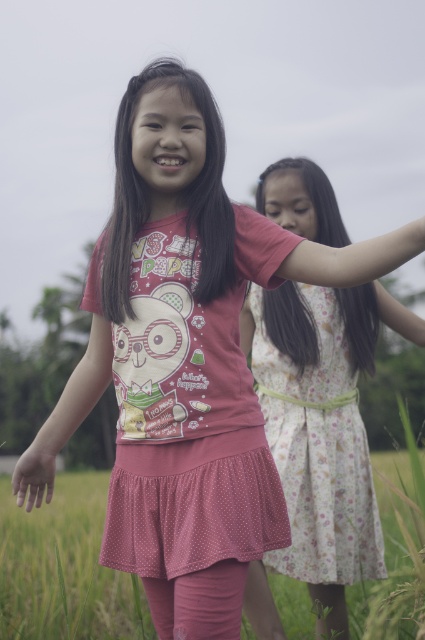
Is point (294, 422) in front of point (34, 480)?

No, (294, 422) is further to viewer.

Is point (314, 390) more distant than point (22, 476)?

That is True.

Which is in front, point (320, 465) or point (34, 481)?

Point (34, 481) is more forward.

What are the coordinates of `floral cotton dress at center` in the screenshot? It's located at (319, 451).

Which is in front, point (51, 544) or point (25, 464)?

Positioned in front is point (25, 464).

Who is more distant from viewer, (25, 516) or (101, 358)?

Point (25, 516)

You are a GUI agent. You are given a task and a screenshot of the screen. Output one action in this format:
    pyautogui.click(x=<x>, y=<y>)
    Task: Click on the pink polka dot skirt at center
    The height and width of the screenshot is (640, 425).
    Given the screenshot: What is the action you would take?
    pyautogui.click(x=65, y=570)

Looking at this image, is pink polka dot dress at center further to camera compared to matte pink hand at lower left?

No.

Between pink polka dot dress at center and matte pink hand at lower left, which one is positioned higher?

pink polka dot dress at center is above.

Where is `pink polka dot dress at center`? Image resolution: width=425 pixels, height=640 pixels. pink polka dot dress at center is located at coordinates (190, 412).